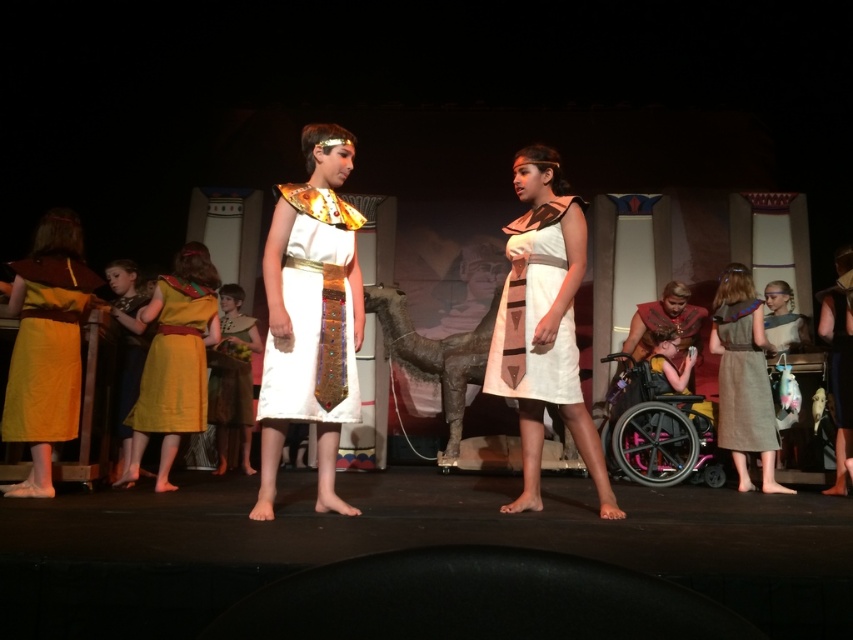
Question: Is white cotton dress at center to the left of white matte dress at center from the viewer's perspective?

Choices:
 (A) no
 (B) yes

Answer: (A)

Question: Considering the relative positions of matte yellow dress at left and white matte dress at center in the image provided, where is matte yellow dress at left located with respect to white matte dress at center?

Choices:
 (A) below
 (B) above

Answer: (A)

Question: Which object is the closest to the white cotton dress at center?

Choices:
 (A) white matte dress at center
 (B) white satin dress at center
 (C) yellow satin dress at left

Answer: (A)

Question: Does white matte dress at center lie behind yellow satin dress at left?

Choices:
 (A) yes
 (B) no

Answer: (B)

Question: Which is nearer to the pink plastic wheelchair at lower right?

Choices:
 (A) white cotton dress at center
 (B) brown textured dress at right

Answer: (B)

Question: Which point appears farthest from the camera in this image?

Choices:
 (A) [665, 404]
 (B) [532, 321]

Answer: (A)